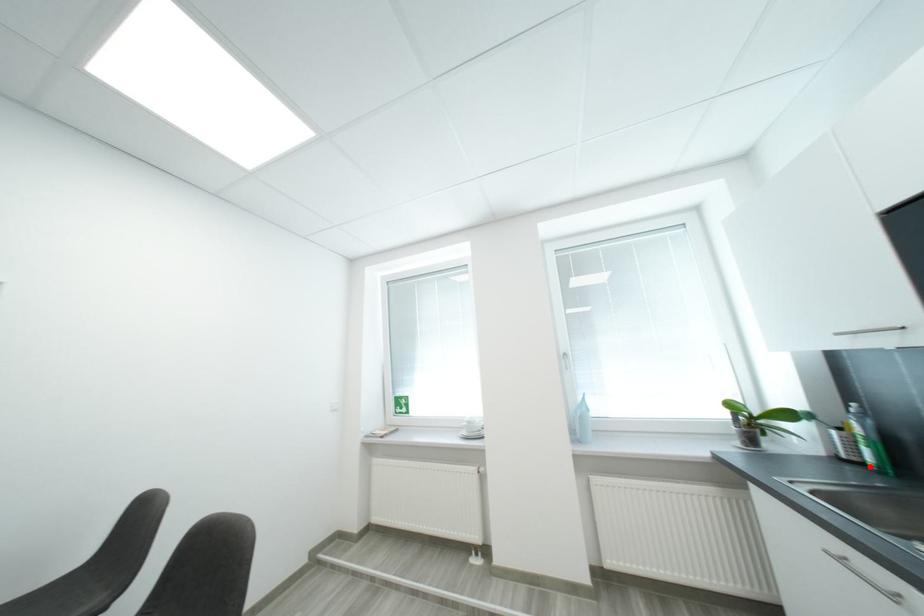
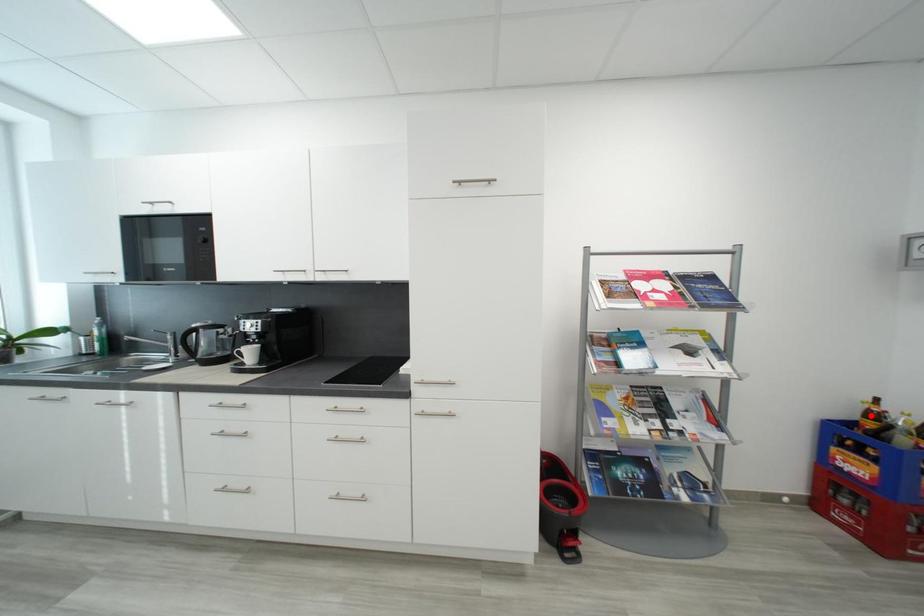
I am providing you with two images of the same scene from different viewpoints. A red point is marked on the first image and another point is marked on the second image. Does the point marked in image1 correspond to the same location as the one in image2?

No